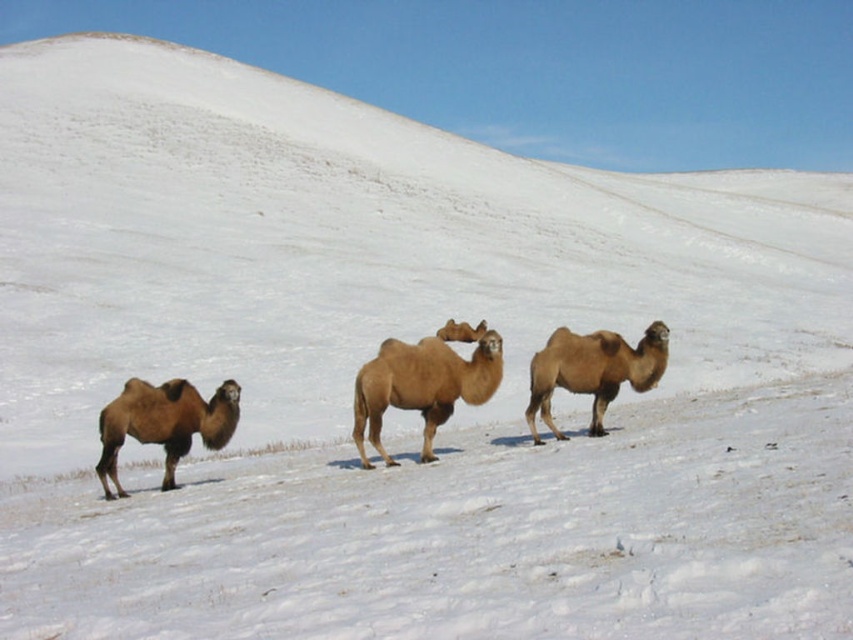
You are a photographer standing in the snowy terrain. You want to take a photo of the light brown woolen camel at center and the light brown fur camel at right. The minimum distance required between the two camels for your camera to focus on both clearly is 8 feet. Can you capture both camels in focus with your current setup?

The light brown woolen camel at center and light brown fur camel at right are 8.25 feet apart, which exceeds the minimum required distance of 8 feet. Therefore, you can capture both camels in focus with your current setup.

You are a photographer trying to capture both the light brown woolen camel at center and the light brown fur camel at center in the same frame. Which camel should you focus on first to ensure both are in the frame?

You should focus on the light brown fur camel at center first because it is larger, allowing you to frame it properly while ensuring the smaller light brown woolen camel at center also fits in the shot.